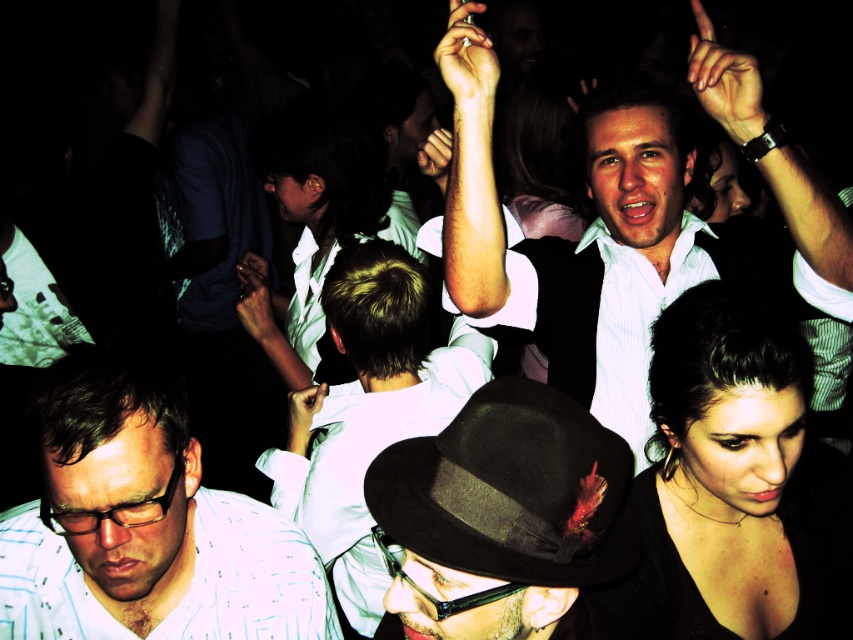
You are standing in the crowd at this event and want to move towards the two points marked in the image. Which point, point [463,445] or point [260,298], is closer to you?

Point [463,445] is closer to the viewer than point [260,298], so you should move towards point [463,445] first.

You are at the event and want to take a photo of both the black matte dress at lower right and the white shirt at center. Since the lighting is dim, you need to ensure both are in the frame. Can you position yourself so that both are visible without moving either object?

The black matte dress at lower right is to the right of the white shirt at center. Since they are positioned side by side horizontally, you can position yourself in a central area between them to capture both in the frame without moving either object.

In the image, you see a dark brown felt fedora at center and a white glossy shirt at center. Which one is positioned to the right?

The dark brown felt fedora at center is to the right of the white glossy shirt at center.